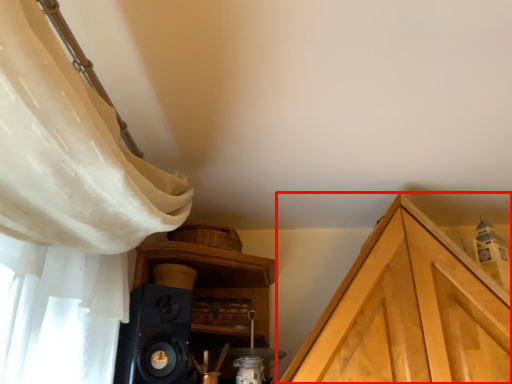
Question: From the image, what is the correct spatial relationship of cabinetry (annotated by the red box) in relation to speaker?

Choices:
 (A) right
 (B) left

Answer: (A)